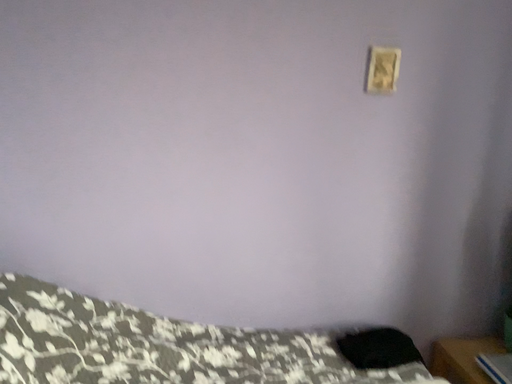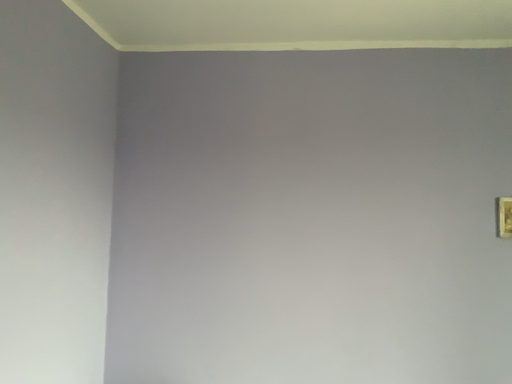
Question: How did the camera likely rotate when shooting the video?

Choices:
 (A) rotated right
 (B) rotated left

Answer: (B)